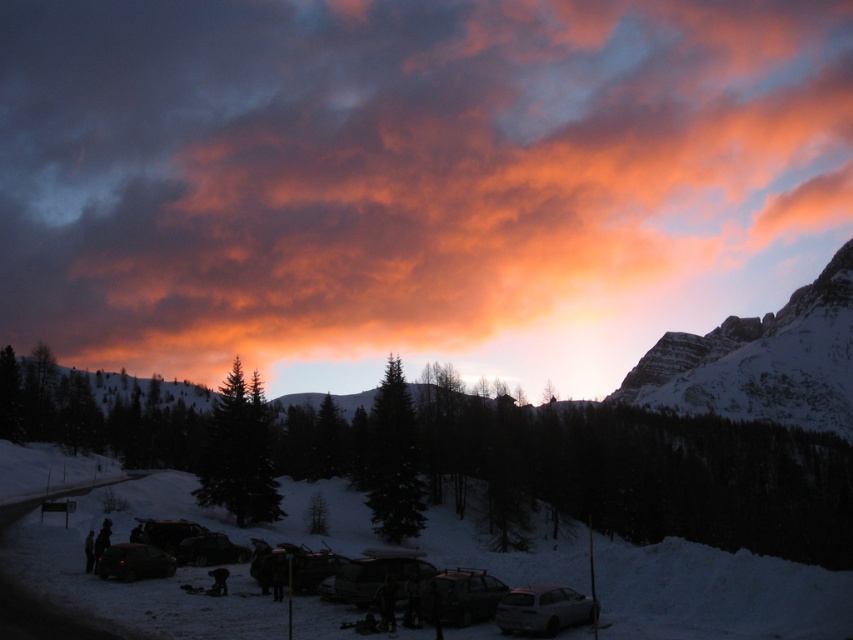
Does orange cotton clouds at upper center appear on the left side of white powdery snow at lower center?

Correct, you'll find orange cotton clouds at upper center to the left of white powdery snow at lower center.

Identify the location of orange cotton clouds at upper center. This screenshot has height=640, width=853. (412, 180).

Consider the image. Which of these two, orange cotton clouds at upper center or snowy rock mountain at upper right, stands shorter?

With less height is snowy rock mountain at upper right.

Is orange cotton clouds at upper center smaller than snowy rock mountain at upper right?

No.

Describe the element at coordinates (412, 180) in the screenshot. I see `orange cotton clouds at upper center` at that location.

This screenshot has width=853, height=640. Identify the location of orange cotton clouds at upper center. (412, 180).

Does metallic silver car at lower center appear on the right side of shiny black car at lower left?

Indeed, metallic silver car at lower center is positioned on the right side of shiny black car at lower left.

Who is taller, metallic silver car at lower center or shiny black car at lower left?

metallic silver car at lower center

Who is more distant from viewer, (491, 605) or (119, 557)?

The point (119, 557) is more distant.

You are a GUI agent. You are given a task and a screenshot of the screen. Output one action in this format:
    pyautogui.click(x=<x>, y=<y>)
    Task: Click on the metallic silver car at lower center
    
    Given the screenshot: What is the action you would take?
    pos(461,595)